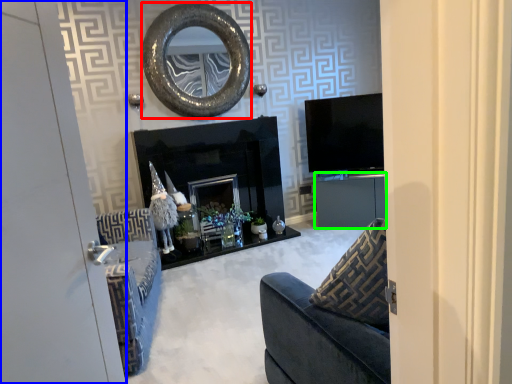
Question: Which object is positioned farthest from oval (highlighted by a red box)? Select from door (highlighted by a blue box) and cabinetry (highlighted by a green box).

Choices:
 (A) door
 (B) cabinetry

Answer: (A)